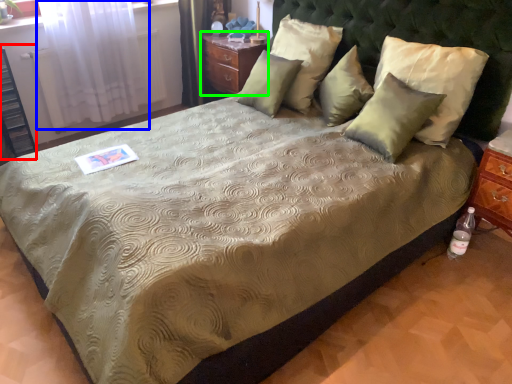
Question: Considering the real-world distances, which object is farthest from dresser (highlighted by a red box)? curtain (highlighted by a blue box) or nightstand (highlighted by a green box)?

Choices:
 (A) curtain
 (B) nightstand

Answer: (B)